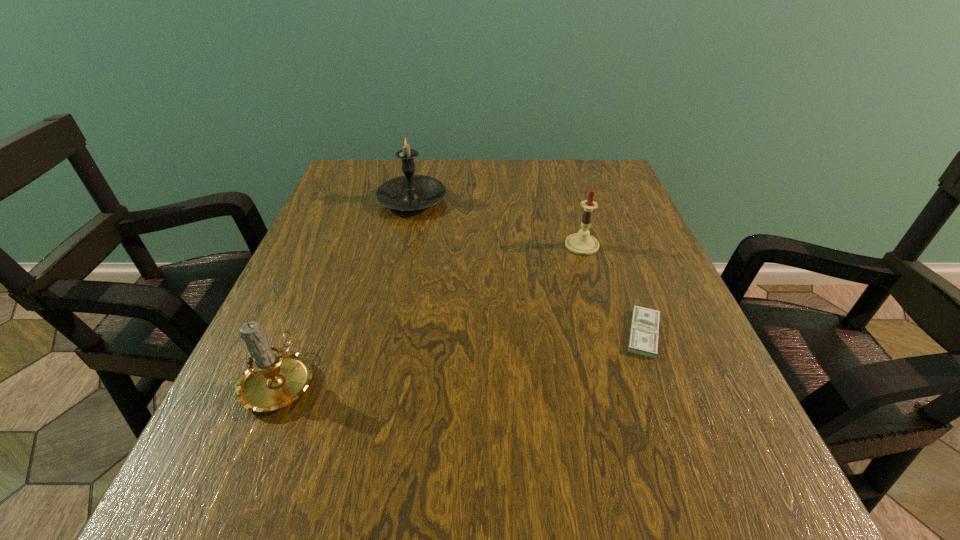
Where is `the second candle from left to right`? the second candle from left to right is located at coordinates (410, 192).

The width and height of the screenshot is (960, 540). I want to click on the farthest candle, so click(410, 192).

Locate an element on the screen. the leftmost candle is located at coordinates (273, 379).

At what (x,y) coordinates should I click in order to perform the action: click on the leftmost object. Please return your answer as a coordinate pair (x, y). The height and width of the screenshot is (540, 960). Looking at the image, I should click on pos(273,379).

The image size is (960, 540). Find the location of `the second nearest candle`. the second nearest candle is located at coordinates (582, 243).

At what (x,y) coordinates should I click in order to perform the action: click on the rightmost candle. Please return your answer as a coordinate pair (x, y). This screenshot has height=540, width=960. Looking at the image, I should click on (582, 243).

You are a GUI agent. You are given a task and a screenshot of the screen. Output one action in this format:
    pyautogui.click(x=<x>, y=<y>)
    Task: Click on the shortest object
    This screenshot has width=960, height=540.
    Given the screenshot: What is the action you would take?
    (644, 331)

In order to click on free space located on the right of the second candle from left to right in this screenshot , I will do `click(596, 200)`.

The height and width of the screenshot is (540, 960). Find the location of `blank space located on the right of the nearest candle`. blank space located on the right of the nearest candle is located at coordinates pos(508,380).

The height and width of the screenshot is (540, 960). Identify the location of free point located 0.260m on the back of the rightmost candle. (563, 177).